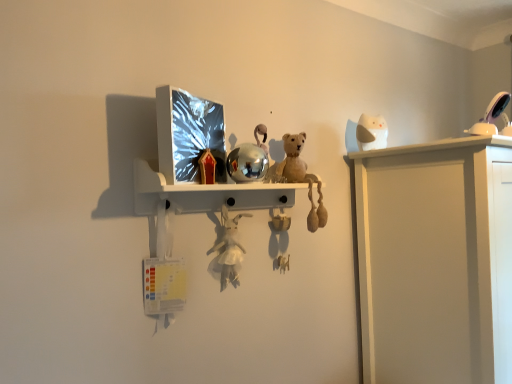
Question: Are white matte owl at upper right, which is counted as the 2th toy, starting from the right, and white glossy lamp at upper right, which is counted as the third toy, starting from the bottom, located far from each other?

Choices:
 (A) no
 (B) yes

Answer: (A)

Question: Considering the relative sizes of white matte owl at upper right, which appears as the second toy when viewed from the left, and white glossy lamp at upper right, which is the second toy from back to front, in the image provided, is white matte owl at upper right, which appears as the second toy when viewed from the left, shorter than white glossy lamp at upper right, which is the second toy from back to front,?

Choices:
 (A) no
 (B) yes

Answer: (A)

Question: From the image's perspective, is white matte owl at upper right, which ranks as the first toy in back-to-front order, beneath white glossy lamp at upper right, acting as the 2th toy starting from the front?

Choices:
 (A) yes
 (B) no

Answer: (A)

Question: From a real-world perspective, is white matte owl at upper right, the 3th toy in the front-to-back sequence, beneath white glossy lamp at upper right, positioned as the first toy in right-to-left order?

Choices:
 (A) yes
 (B) no

Answer: (B)

Question: Can you confirm if white matte owl at upper right, which ranks as the first toy in back-to-front order, is smaller than white glossy lamp at upper right, positioned as the first toy in right-to-left order?

Choices:
 (A) yes
 (B) no

Answer: (B)

Question: From a real-world perspective, relative to white matte owl at upper right, placed as the 2th toy when sorted from bottom to top, is white plush toy at center, marked as the 1th toy in a left-to-right arrangement, vertically above or below?

Choices:
 (A) below
 (B) above

Answer: (A)

Question: Relative to white matte owl at upper right, which appears as the second toy when viewed from the left, is white plush toy at center, acting as the third toy starting from the back, in front or behind?

Choices:
 (A) behind
 (B) front

Answer: (B)

Question: Considering the positions of white plush toy at center, which is the first toy from bottom to top, and white matte owl at upper right, which ranks as the first toy in back-to-front order, in the image, is white plush toy at center, which is the first toy from bottom to top, wider or thinner than white matte owl at upper right, which ranks as the first toy in back-to-front order,?

Choices:
 (A) thin
 (B) wide

Answer: (A)

Question: From the image's perspective, is white plush toy at center, the third toy viewed from the top, located above or below white matte owl at upper right, which appears as the second toy when viewed from the left?

Choices:
 (A) below
 (B) above

Answer: (A)

Question: In the image, is white glossy lamp at upper right, acting as the 2th toy starting from the front, on the left side or the right side of white plush toy at center, acting as the third toy starting from the back?

Choices:
 (A) right
 (B) left

Answer: (A)

Question: From the image's perspective, relative to white plush toy at center, positioned as the 1th toy in front-to-back order, is white glossy lamp at upper right, which is the first toy in top-to-bottom order, above or below?

Choices:
 (A) above
 (B) below

Answer: (A)

Question: In terms of height, does white glossy lamp at upper right, the 3th toy viewed from the left, look taller or shorter compared to white plush toy at center, marked as the 1th toy in a left-to-right arrangement?

Choices:
 (A) tall
 (B) short

Answer: (B)

Question: From a real-world perspective, is white glossy lamp at upper right, the 3th toy viewed from the left, physically located above or below white plush toy at center, acting as the third toy starting from the back?

Choices:
 (A) below
 (B) above

Answer: (B)

Question: In terms of width, does white matte owl at upper right, placed as the 2th toy when sorted from bottom to top, look wider or thinner when compared to white plush toy at center, placed as the third toy when sorted from right to left?

Choices:
 (A) thin
 (B) wide

Answer: (B)

Question: Is point (378, 140) closer or farther from the camera than point (224, 264)?

Choices:
 (A) farther
 (B) closer

Answer: (A)